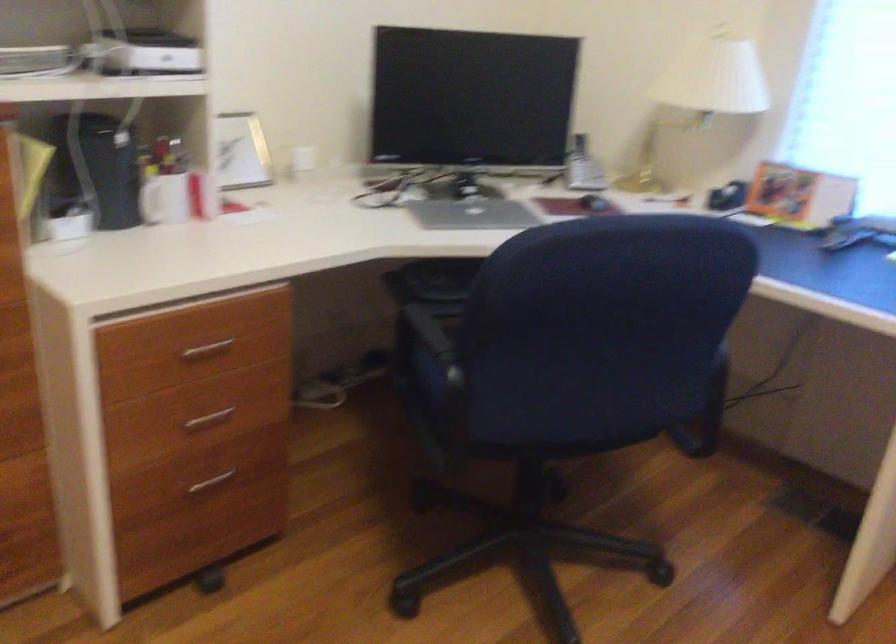
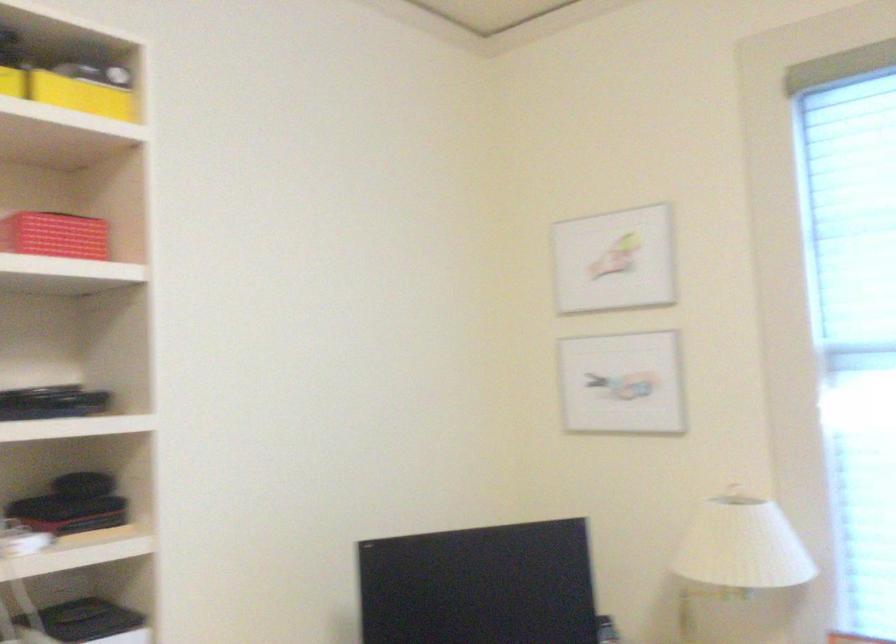
Question: How did the camera likely rotate?

Choices:
 (A) Left
 (B) Right
 (C) Up
 (D) Down

Answer: (C)